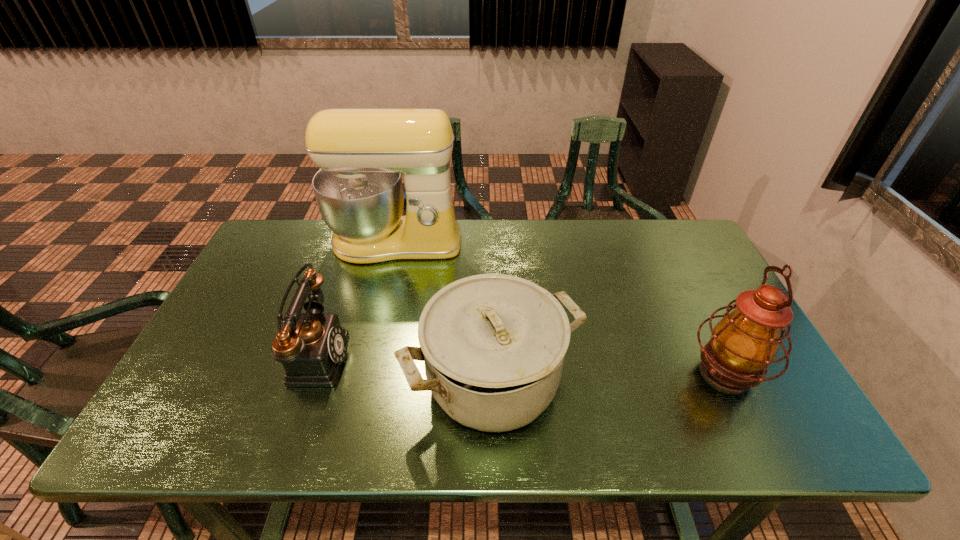
The width and height of the screenshot is (960, 540). I want to click on mixer, so click(x=361, y=153).

The height and width of the screenshot is (540, 960). I want to click on the farthest object, so click(x=361, y=153).

Locate an element on the screen. the rightmost object is located at coordinates (x=744, y=343).

You are a GUI agent. You are given a task and a screenshot of the screen. Output one action in this format:
    pyautogui.click(x=<x>, y=<y>)
    Task: Click on the third shortest object
    The image size is (960, 540).
    Given the screenshot: What is the action you would take?
    pyautogui.click(x=744, y=343)

This screenshot has width=960, height=540. I want to click on telephone, so click(311, 354).

This screenshot has width=960, height=540. Identify the location of saucepan. (494, 345).

Where is `vacant area located on the side of the farthest object with the control knob`? The height and width of the screenshot is (540, 960). vacant area located on the side of the farthest object with the control knob is located at coordinates (375, 330).

Locate an element on the screen. The width and height of the screenshot is (960, 540). vacant space positioned on the left of the rightmost object is located at coordinates (540, 373).

The image size is (960, 540). Find the location of `vacant space located on the front of the telephone at the rotary dial`. vacant space located on the front of the telephone at the rotary dial is located at coordinates (385, 355).

Locate an element on the screen. free space located 0.230m on the back of the saucepan is located at coordinates (490, 272).